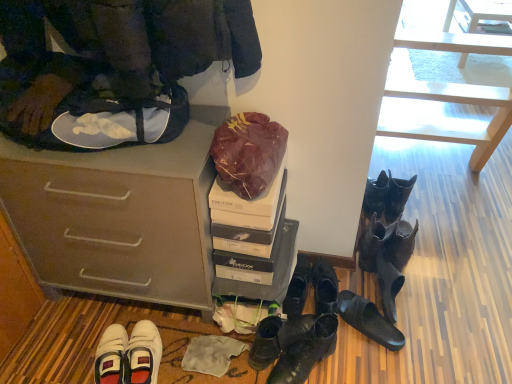
At what (x,y) coordinates should I click in order to perform the action: click on free space above black leather shoes at center, the sixth footwear viewed from the right (from a real-world perspective). Please return your answer as a coordinate pair (x, y). Looking at the image, I should click on (296, 273).